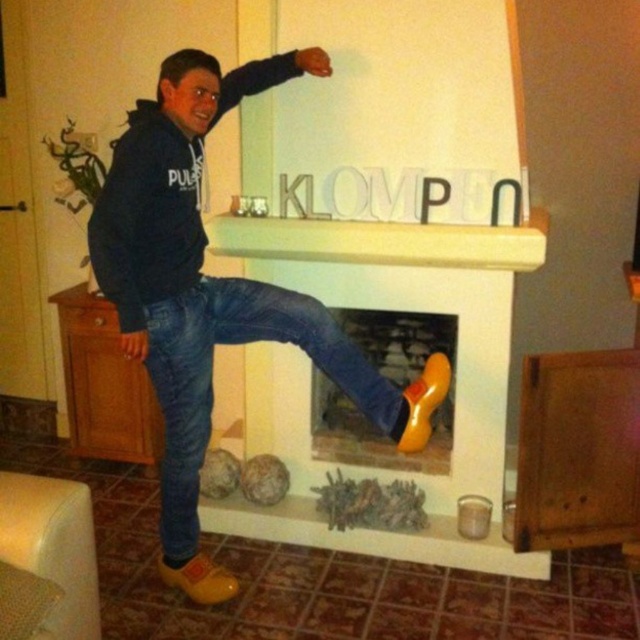
Question: Which of the following is the closest to the observer?

Choices:
 (A) (205, 353)
 (B) (198, 310)

Answer: (B)

Question: Observing the image, what is the correct spatial positioning of yellow leather clogs at center in reference to jeans at center?

Choices:
 (A) right
 (B) left

Answer: (A)

Question: Which point appears farthest from the camera in this image?

Choices:
 (A) (188, 483)
 (B) (161, 346)

Answer: (A)

Question: Among these points, which one is farthest from the camera?

Choices:
 (A) click(189, 298)
 (B) click(198, 216)

Answer: (B)

Question: Can you confirm if yellow leather clogs at center is wider than jeans at center?

Choices:
 (A) yes
 (B) no

Answer: (A)

Question: Does yellow leather clogs at center have a smaller size compared to jeans at center?

Choices:
 (A) no
 (B) yes

Answer: (A)